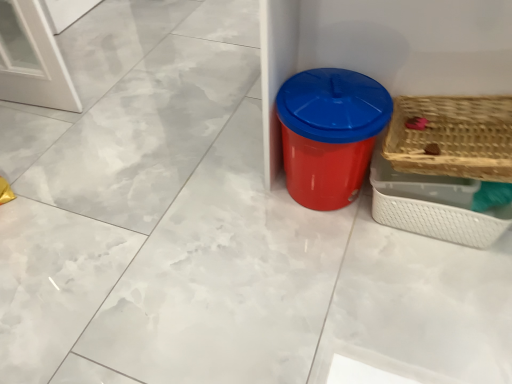
Question: From the image's perspective, would you say woven wood basket at right, the 2th basket in the bottom-to-top sequence, is positioned over red plastic bin at center?

Choices:
 (A) yes
 (B) no

Answer: (B)

Question: From the image's perspective, does woven wood basket at right, the 2th basket in the bottom-to-top sequence, appear lower than red plastic bin at center?

Choices:
 (A) yes
 (B) no

Answer: (A)

Question: Does woven wood basket at right, the 1th basket from the top, touch red plastic bin at center?

Choices:
 (A) no
 (B) yes

Answer: (A)

Question: Can you confirm if woven wood basket at right, the 1th basket from the top, is wider than red plastic bin at center?

Choices:
 (A) no
 (B) yes

Answer: (A)

Question: From a real-world perspective, is woven wood basket at right, the 1th basket from the top, on top of red plastic bin at center?

Choices:
 (A) no
 (B) yes

Answer: (B)

Question: Is woven wood basket at right, the 1th basket from the top, looking in the opposite direction of red plastic bin at center?

Choices:
 (A) yes
 (B) no

Answer: (B)

Question: Does red plastic bin at center have a greater height compared to woven wood basket at right, the 2th basket in the bottom-to-top sequence?

Choices:
 (A) yes
 (B) no

Answer: (A)

Question: Could you tell me if red plastic bin at center is turned towards woven wood basket at right, the 2th basket in the bottom-to-top sequence?

Choices:
 (A) no
 (B) yes

Answer: (A)

Question: Are red plastic bin at center and woven wood basket at right, the 2th basket in the bottom-to-top sequence, making contact?

Choices:
 (A) no
 (B) yes

Answer: (A)

Question: From the image's perspective, is red plastic bin at center located beneath woven wood basket at right, the 2th basket in the bottom-to-top sequence?

Choices:
 (A) no
 (B) yes

Answer: (A)

Question: Is red plastic bin at center positioned far away from woven wood basket at right, the 1th basket from the top?

Choices:
 (A) no
 (B) yes

Answer: (A)

Question: Is woven wood basket at right, the 2th basket in the bottom-to-top sequence, inside red plastic bin at center?

Choices:
 (A) no
 (B) yes

Answer: (A)

Question: Is red plastic bin at center in front of woven wood basket at right, which appears as the 1th basket when ordered from the bottom?

Choices:
 (A) yes
 (B) no

Answer: (A)